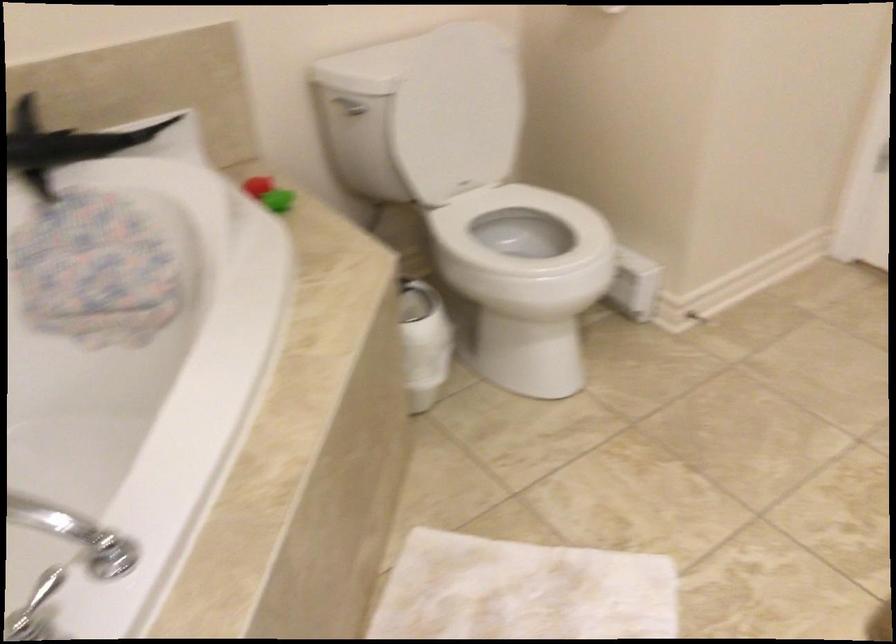
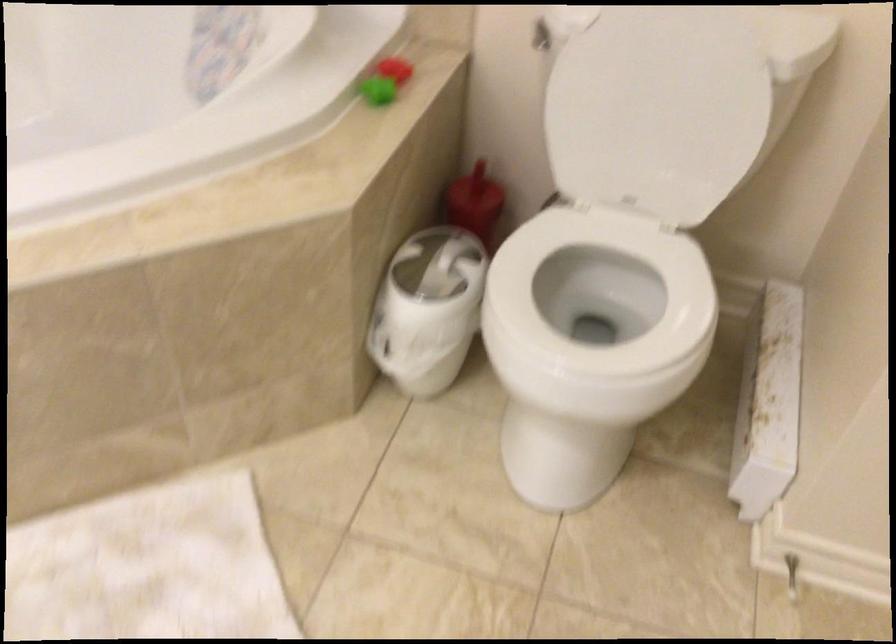
Where in the second image is the point corresponding to pixel 420 381 from the first image?

(392, 357)